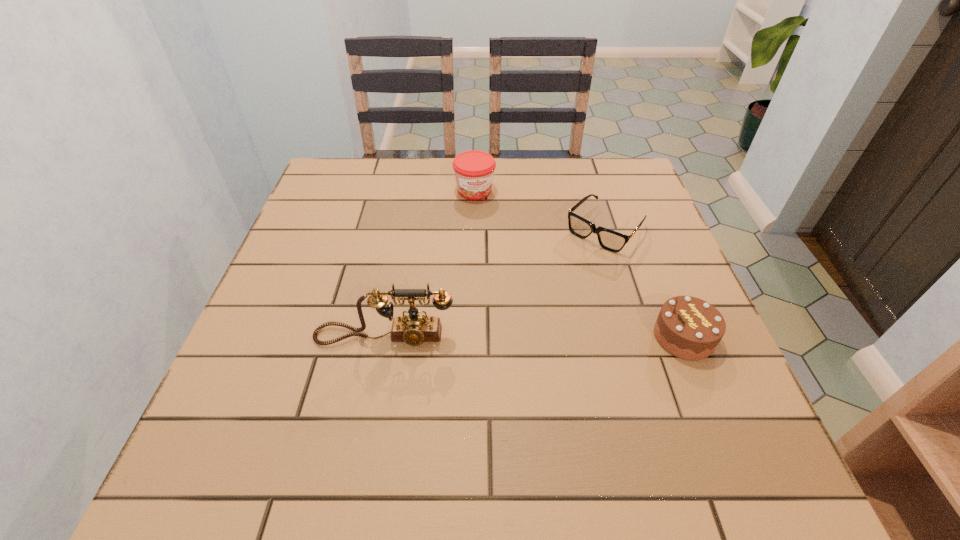
You are a GUI agent. You are given a task and a screenshot of the screen. Output one action in this format:
    pyautogui.click(x=<x>, y=<y>)
    Task: Click on the telephone
    The image size is (960, 540).
    Given the screenshot: What is the action you would take?
    pyautogui.click(x=414, y=328)

Where is `chocolate cake`? The width and height of the screenshot is (960, 540). chocolate cake is located at coordinates (687, 327).

Where is `the farthest object`? the farthest object is located at coordinates (474, 170).

Locate an element on the screen. The width and height of the screenshot is (960, 540). the second farthest object is located at coordinates (613, 241).

Locate an element on the screen. sunglasses is located at coordinates (613, 241).

Locate an element on the screen. The height and width of the screenshot is (540, 960). free space located on the front-facing side of the telephone is located at coordinates (370, 410).

In order to click on free space located on the left of the chocolate cake in this screenshot , I will do [x=484, y=337].

The height and width of the screenshot is (540, 960). I want to click on free space located on the label side of the jam, so [493, 239].

Find the location of a particular element. The height and width of the screenshot is (540, 960). vacant space located on the label side of the jam is located at coordinates (516, 298).

Locate an element on the screen. vacant space situated 0.120m on the label side of the jam is located at coordinates (490, 230).